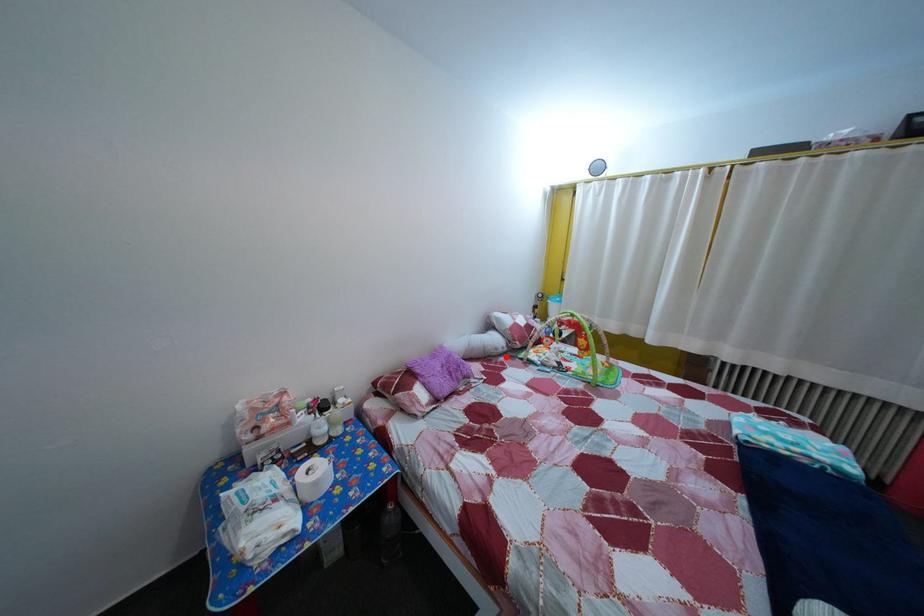
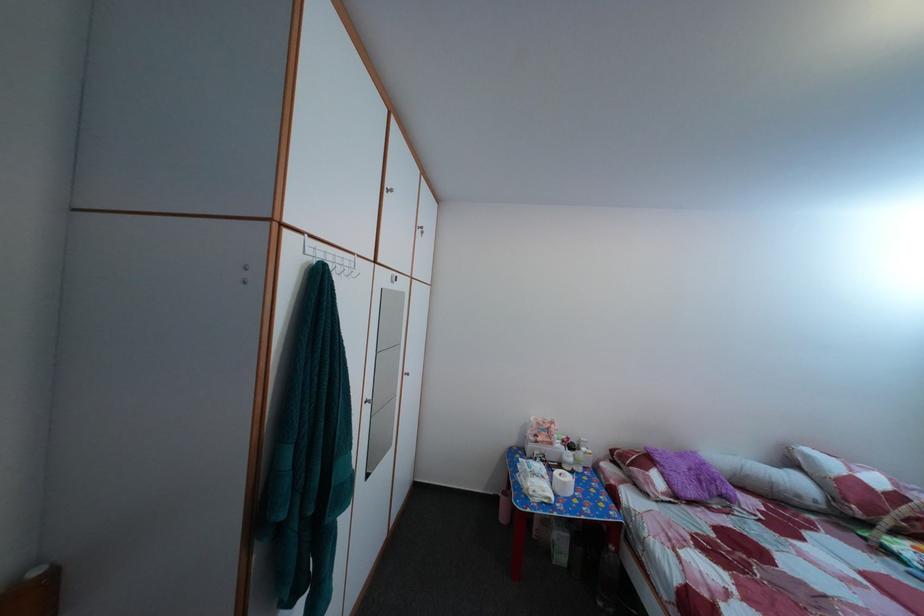
Find the pixel in the second image that matches the highlighted location in the first image.

(808, 504)